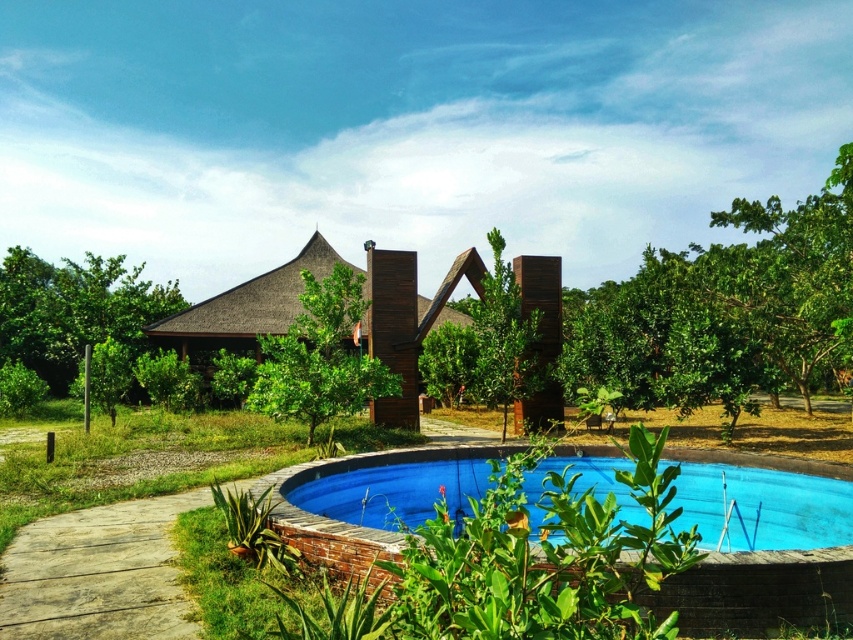
You are planning to plant a new tree in your backyard. You have two options from the image shown. The green leafy tree at left and the brown wooden hut at center. Which one is a better choice if you want a larger tree to provide more shade?

The green leafy tree at left is bigger than the brown wooden hut at center, so it would be a better choice for providing more shade due to its larger size.

You are standing in the outdoor area and want to take a photo of both the blue ceramic swimming pool at lower center and the green leafy tree at center. Which object should you focus on first to ensure both are in the frame?

You should focus on the blue ceramic swimming pool at lower center first because it is closer to the viewer than the green leafy tree at center, so adjusting the camera to include the closer object first will help frame both properly.

You are standing at the entrance of the building and want to walk to the blue ceramic swimming pool at lower center. Which direction should you walk relative to the green leafy tree at center?

You should walk downward towards the blue ceramic swimming pool at lower center since it is located below the green leafy tree at center.